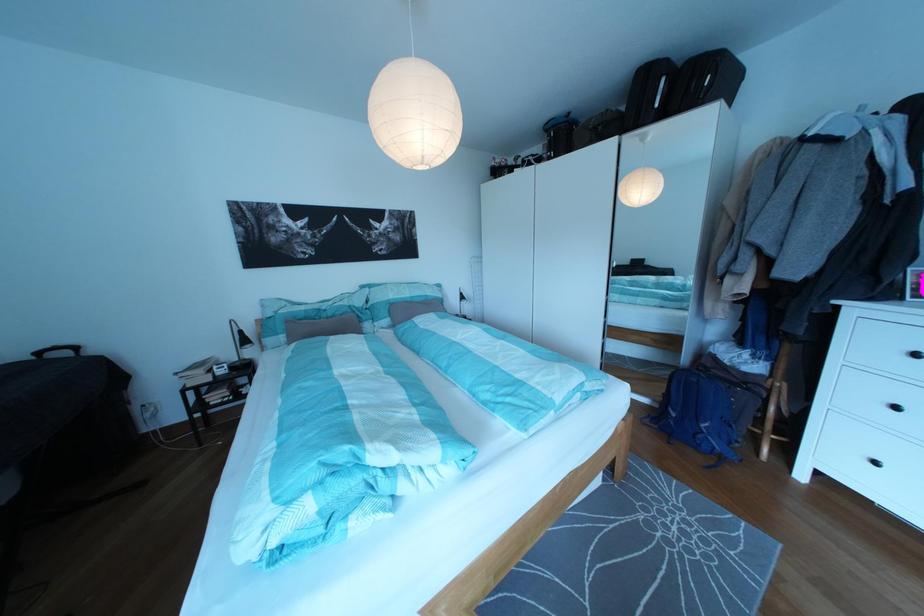
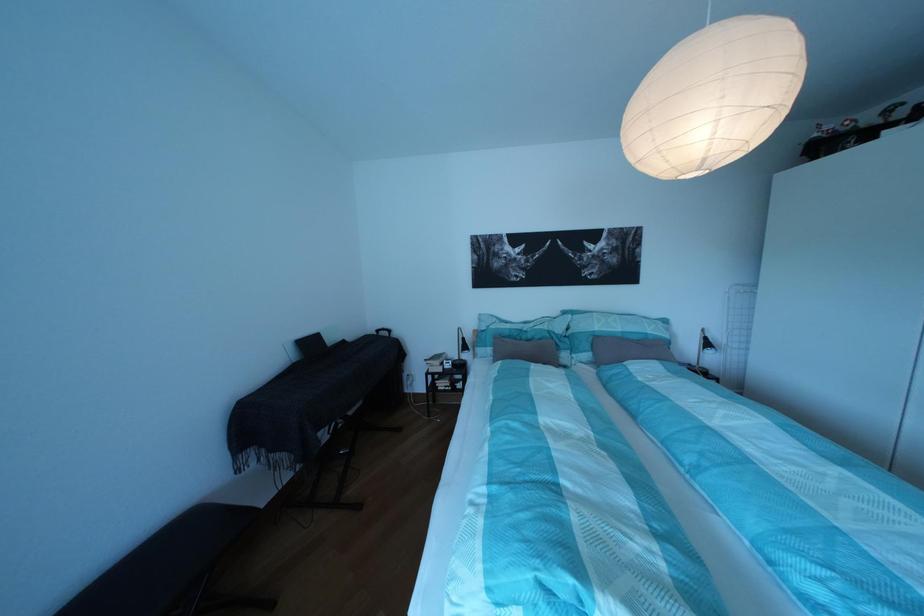
Locate, in the second image, the point that corresponds to (381,294) in the first image.

(582, 322)